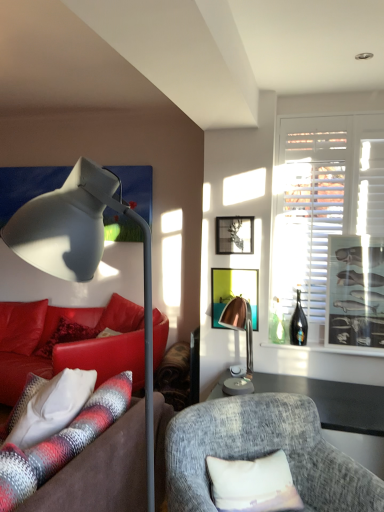
Question: Could you tell me if clear glass bottle at right is facing copper metallic lamp at center, positioned as the 2th lamp in front-to-back order?

Choices:
 (A) yes
 (B) no

Answer: (B)

Question: Would you say clear glass bottle at right is a long distance from copper metallic lamp at center, which is counted as the 1th lamp, starting from the back?

Choices:
 (A) no
 (B) yes

Answer: (A)

Question: Is clear glass bottle at right closer to the viewer compared to copper metallic lamp at center, which is counted as the first lamp, starting from the right?

Choices:
 (A) yes
 (B) no

Answer: (B)

Question: Is clear glass bottle at right placed right next to copper metallic lamp at center, positioned as the 2th lamp in front-to-back order?

Choices:
 (A) yes
 (B) no

Answer: (B)

Question: Is clear glass bottle at right to the left of copper metallic lamp at center, which is counted as the 1th lamp, starting from the back, from the viewer's perspective?

Choices:
 (A) no
 (B) yes

Answer: (A)

Question: Choose the correct answer: Is metallic silver picture frame at upper center, placed as the third picture frame when sorted from right to left, inside plush brown couch at left, positioned as the 1th studio couch in front-to-back order, or outside it?

Choices:
 (A) outside
 (B) inside

Answer: (A)

Question: In the image, is metallic silver picture frame at upper center, marked as the first picture frame in a left-to-right arrangement, positioned in front of or behind plush brown couch at left, arranged as the second studio couch when viewed from the back?

Choices:
 (A) front
 (B) behind

Answer: (B)

Question: Considering the positions of metallic silver picture frame at upper center, placed as the third picture frame when sorted from right to left, and plush brown couch at left, positioned as the 1th studio couch in front-to-back order, in the image, is metallic silver picture frame at upper center, placed as the third picture frame when sorted from right to left, wider or thinner than plush brown couch at left, positioned as the 1th studio couch in front-to-back order,?

Choices:
 (A) thin
 (B) wide

Answer: (A)

Question: Based on their sizes in the image, would you say metallic silver picture frame at upper center, placed as the third picture frame when sorted from right to left, is bigger or smaller than plush brown couch at left, arranged as the second studio couch when viewed from the back?

Choices:
 (A) big
 (B) small

Answer: (B)

Question: In terms of width, does matte green picture frame at center, which ranks as the second picture frame in left-to-right order, look wider or thinner when compared to metallic silver picture frame at right, which is the first picture frame in right-to-left order?

Choices:
 (A) thin
 (B) wide

Answer: (A)

Question: From their relative heights in the image, would you say matte green picture frame at center, which ranks as the second picture frame in left-to-right order, is taller or shorter than metallic silver picture frame at right, which is the 3th picture frame in left-to-right order?

Choices:
 (A) tall
 (B) short

Answer: (B)

Question: From a real-world perspective, is matte green picture frame at center, which ranks as the second picture frame in left-to-right order, physically located above or below metallic silver picture frame at right, which is the 3th picture frame in left-to-right order?

Choices:
 (A) below
 (B) above

Answer: (A)

Question: In terms of size, does matte green picture frame at center, which is the 2th picture frame from right to left, appear bigger or smaller than metallic silver picture frame at right, which is the first picture frame in right-to-left order?

Choices:
 (A) small
 (B) big

Answer: (A)

Question: Does point (286, 261) appear closer or farther from the camera than point (104, 345)?

Choices:
 (A) farther
 (B) closer

Answer: (B)

Question: In terms of height, does white matte window at right look taller or shorter compared to leather couch at left, the first studio couch from the back?

Choices:
 (A) tall
 (B) short

Answer: (A)